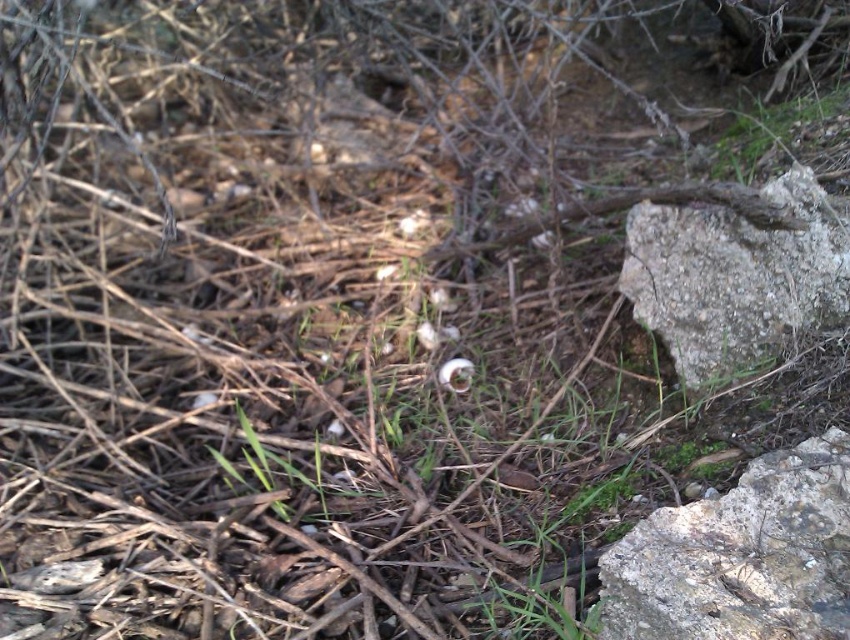
Between gray rough rock at right and white matte flower at center, which one has more height?

Standing taller between the two is gray rough rock at right.

Can you confirm if gray rough rock at right is shorter than white matte flower at center?

No, gray rough rock at right is not shorter than white matte flower at center.

What do you see at coordinates (735, 276) in the screenshot? The height and width of the screenshot is (640, 850). I see `gray rough rock at right` at bounding box center [735, 276].

At what (x,y) coordinates should I click in order to perform the action: click on gray rough rock at right. Please return your answer as a coordinate pair (x, y). Looking at the image, I should click on (735, 276).

Is gray rough rock at lower right to the left of gray rough rock at right from the viewer's perspective?

Yes, gray rough rock at lower right is to the left of gray rough rock at right.

Is gray rough rock at lower right positioned at the back of gray rough rock at right?

No, gray rough rock at lower right is closer to the viewer.

Locate an element on the screen. The width and height of the screenshot is (850, 640). gray rough rock at lower right is located at coordinates (740, 556).

Who is more distant from viewer, (755, 497) or (469, 376)?

The point (469, 376) is behind.

Does point (794, 476) lie behind point (459, 360)?

No, (794, 476) is in front of (459, 360).

Between point (629, 611) and point (446, 369), which one is positioned in front?

Positioned in front is point (629, 611).

Image resolution: width=850 pixels, height=640 pixels. What are the coordinates of `gray rough rock at lower right` in the screenshot? It's located at (740, 556).